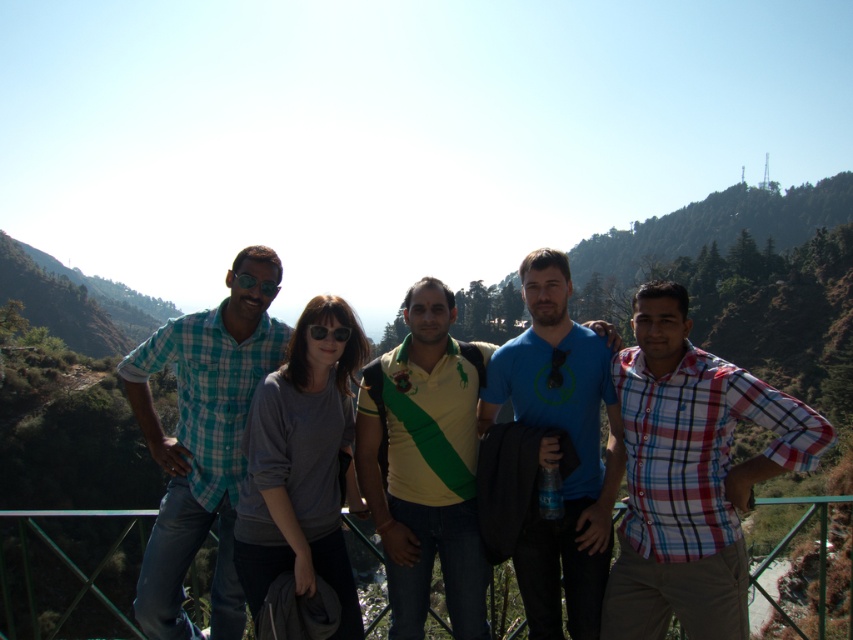
Question: Which point appears farthest from the camera in this image?

Choices:
 (A) (704, 404)
 (B) (379, 368)

Answer: (B)

Question: Can you confirm if yellow-green jersey at center is bigger than green metallic rail at center?

Choices:
 (A) yes
 (B) no

Answer: (B)

Question: Does yellow-green jersey at center appear over green metallic rail at center?

Choices:
 (A) yes
 (B) no

Answer: (A)

Question: Which object is closer to the camera taking this photo?

Choices:
 (A) green metallic rail at center
 (B) plaid cotton shirt at right
 (C) yellow-green jersey at center
 (D) teal plaid shirt at left

Answer: (B)

Question: Estimate the real-world distances between objects in this image. Which object is farther from the green metallic rail at center?

Choices:
 (A) plaid cotton shirt at right
 (B) yellow-green jersey at center
 (C) teal plaid shirt at left

Answer: (B)

Question: Is teal plaid shirt at left to the right of green metallic rail at center from the viewer's perspective?

Choices:
 (A) yes
 (B) no

Answer: (B)